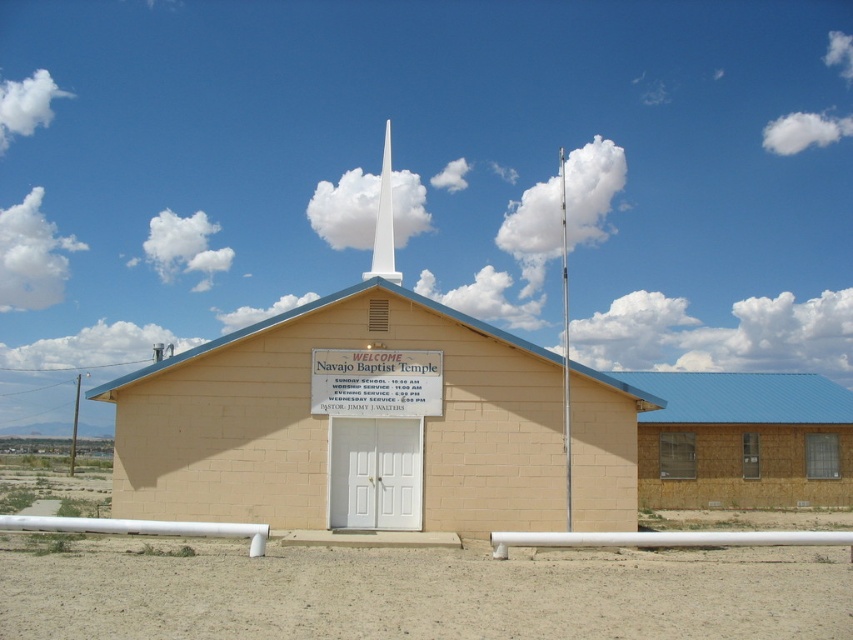
You are standing in front of the church and want to take a photo of the white smooth spire at center. Since the beige brick chapel at center is blocking your view, can you move to the left or right to get a clear shot of the spire?

The beige brick chapel at center is closer to the viewer than the white smooth spire at center, so moving to either the left or right side might allow you to position yourself around the chapel and get a clear view of the spire.

In the scene shown: You are standing in front of the church and want to enter the building. The white smooth spire at center is blocking your view of the entrance. Can you walk around the beige brick chapel at center to find the entrance?

The beige brick chapel at center is positioned under the white smooth spire at center, so the spire is above the chapel and not blocking the entrance. Therefore, you can see the entrance directly without needing to walk around.